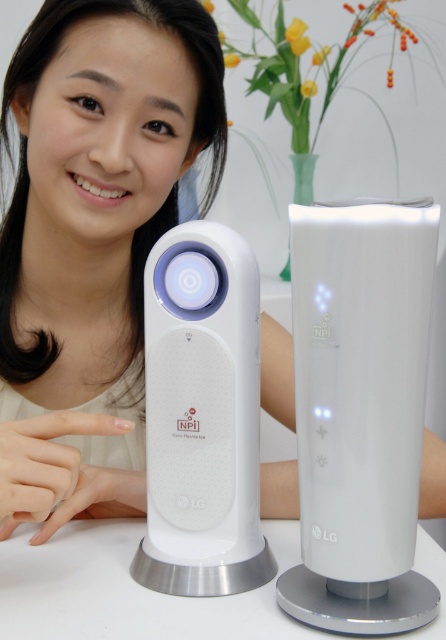
Question: Can you confirm if white glossy tower at center is positioned below white glossy speaker at center?

Choices:
 (A) no
 (B) yes

Answer: (A)

Question: Which point appears farthest from the camera in this image?

Choices:
 (A) (217, 625)
 (B) (360, 300)

Answer: (A)

Question: Which object is closer to the camera taking this photo?

Choices:
 (A) white glossy tower at center
 (B) white glossy table at center
 (C) white glossy speaker at center

Answer: (A)

Question: Which point is farther to the camera?

Choices:
 (A) white glossy speaker at center
 (B) white glossy table at center
 (C) white glossy tower at center

Answer: (A)

Question: Is white glossy tower at center to the right of white glossy table at center from the viewer's perspective?

Choices:
 (A) yes
 (B) no

Answer: (A)

Question: Is white glossy tower at center above white glossy speaker at center?

Choices:
 (A) no
 (B) yes

Answer: (B)